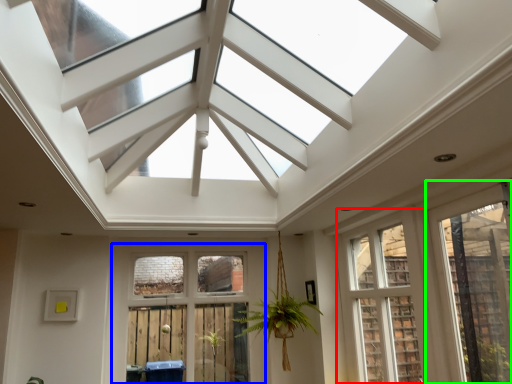
Question: Which object is the farthest from window (highlighted by a red box)? Choose among these: window (highlighted by a blue box) or window (highlighted by a green box).

Choices:
 (A) window
 (B) window

Answer: (A)